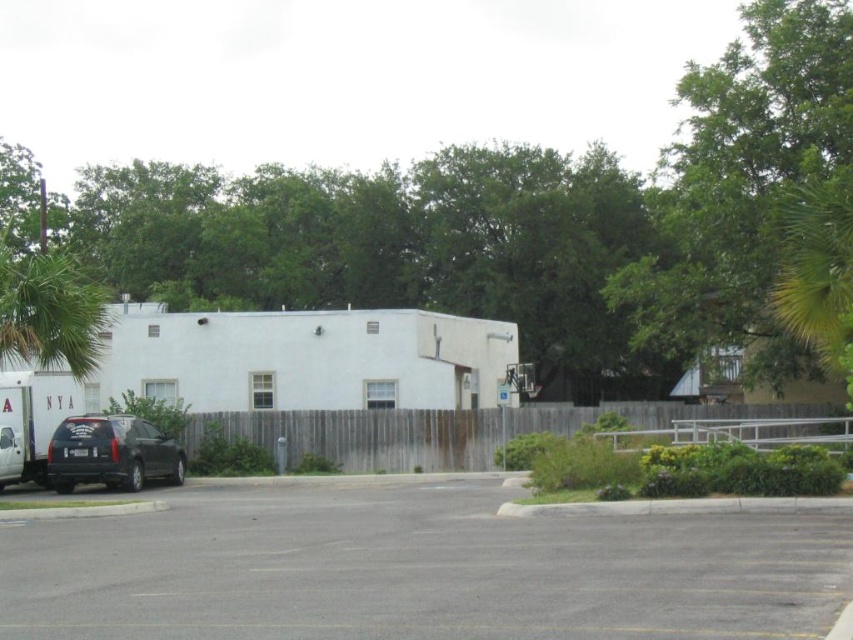
You are a delivery driver who needs to park your vehicle in the parking lot shown in the image. You notice the green leafy tree at upper right and the matte black suv at lower left. Which vehicle should you avoid parking under to prevent damage from falling leaves?

You should avoid parking under the green leafy tree at upper right because it is positioned over the matte black suv at lower left, meaning it could drop leaves or debris onto any vehicle parked there.

You are standing at the entrance of the white building and want to park your car. The gray asphalt parking lot at center is your only option. Can you see the green leafy tree at upper right from your parking spot?

The gray asphalt parking lot at center is below the green leafy tree at upper right, so yes, you can see the green leafy tree at upper right from your parking spot.